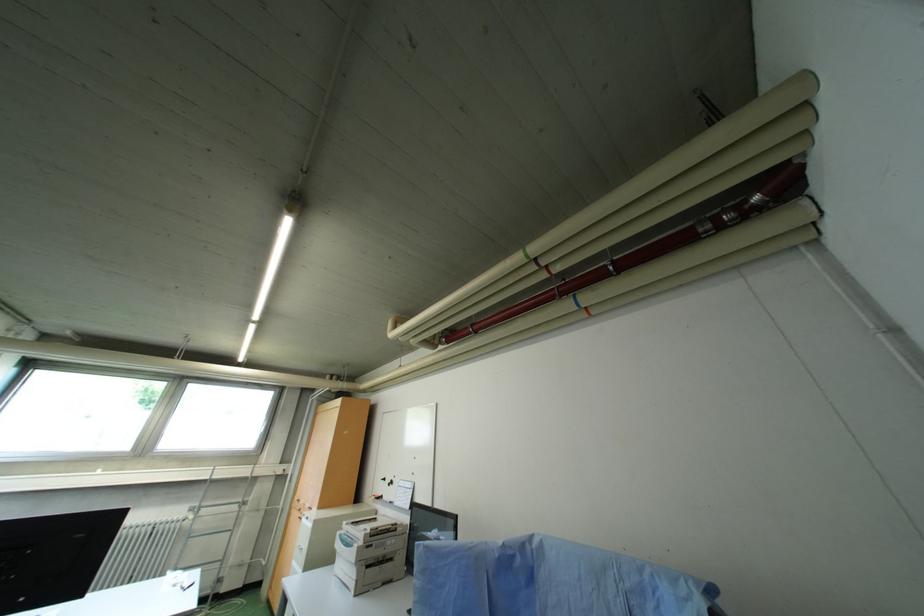
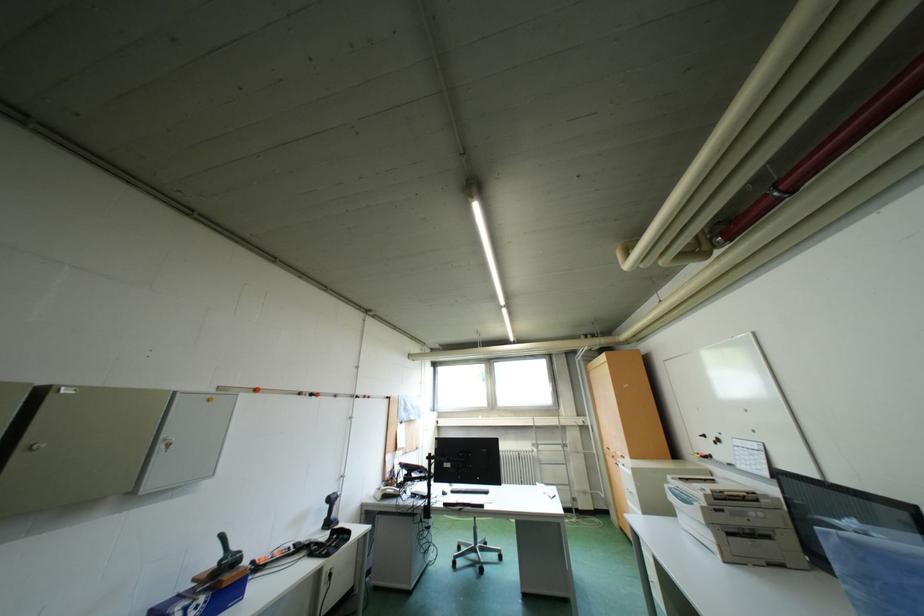
Question: The first image is from the beginning of the video and the second image is from the end. How did the camera likely rotate when shooting the video?

Choices:
 (A) Left
 (B) Right
 (C) Up
 (D) Down

Answer: (A)